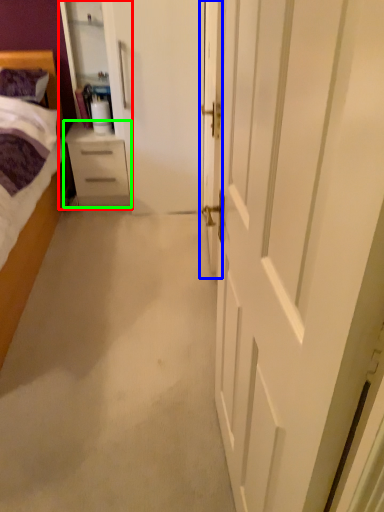
Question: Which object is the closest to the armoire (highlighted by a red box)? Choose among these: door (highlighted by a blue box) or chest of drawers (highlighted by a green box).

Choices:
 (A) door
 (B) chest of drawers

Answer: (B)